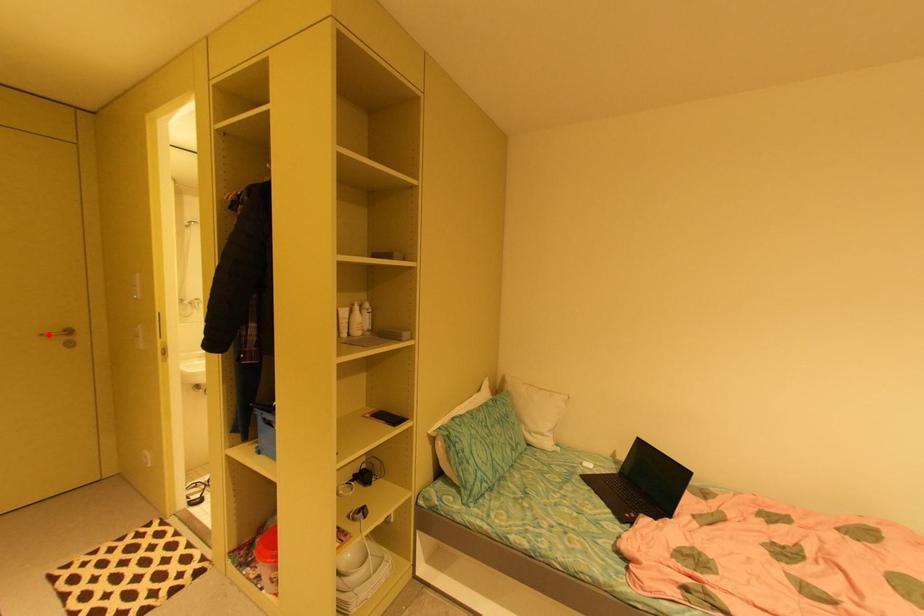
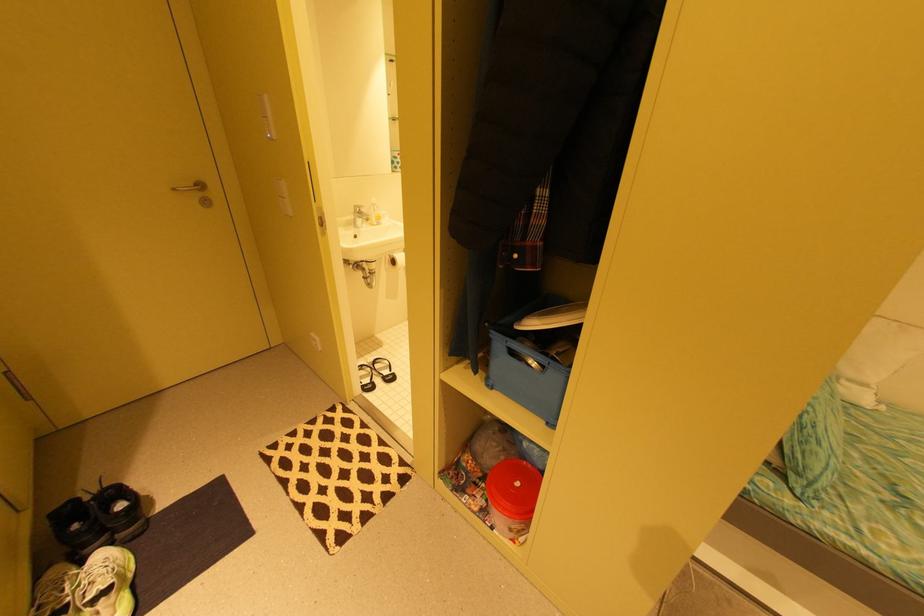
Find the pixel in the second image that matches the highlighted location in the first image.

(179, 190)